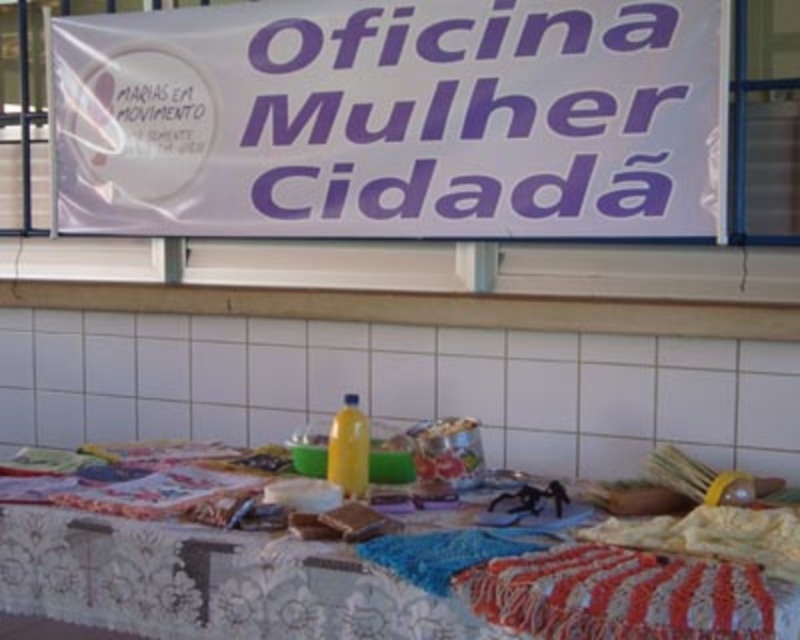
You are attending the Women Citizens Workshop and need to place a small object on the table. You have two points to choose from on the table surface. The first point is at coordinates point (108, 131) and the second is at point (602, 627). Which point is closer to you?

Point (108, 131) is closer to you than point (602, 627).

You are an attendee at the Women Citizenship Workshop. You want to reach for the striped crochet blanket at lower right but need to pass the textured fabric tablecloth at center. Which object is closer to you as you approach the table?

The textured fabric tablecloth at center is closer to you than the striped crochet blanket at lower right, so you must move it first to reach the striped crochet blanket at lower right.

You are an event organizer who wants to place a new sign on the table. The coordinates of the point where you want to place it are point (393, 118). According to the scene description, where exactly is this point located?

The point (393, 118) is on the white paper banner at upper center.